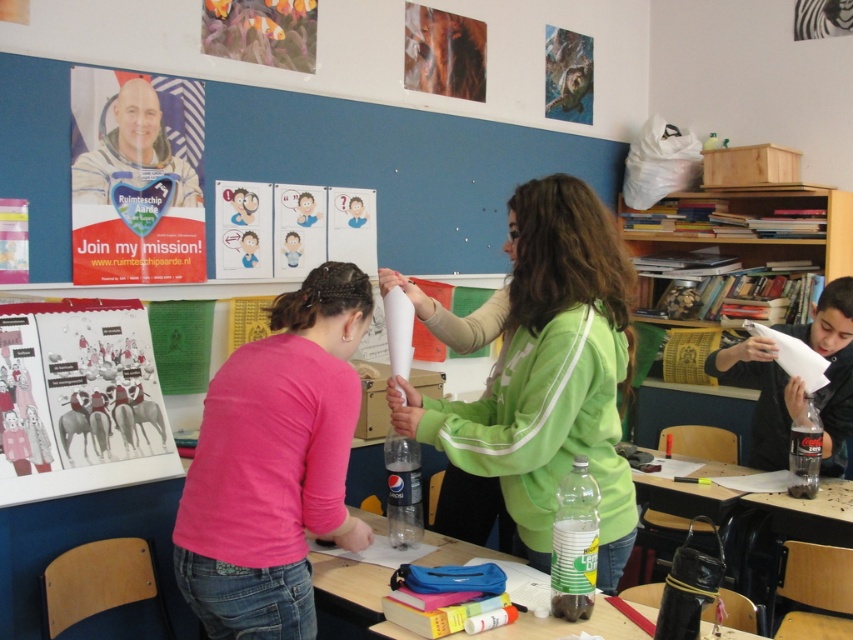
Question: Can you confirm if matte paper poster at upper left is thinner than translucent plastic bottle at center?

Choices:
 (A) no
 (B) yes

Answer: (B)

Question: Which object is farther from the camera taking this photo?

Choices:
 (A) space suit astronaut at upper left
 (B) translucent plastic bottle at center
 (C) pink fabric shirt at center
 (D) black plastic bottle at right

Answer: (D)

Question: Which point is farther to the camera?

Choices:
 (A) (605, 305)
 (B) (49, 323)
 (C) (312, 566)
 (D) (735, 369)

Answer: (D)

Question: Is matte green sweatshirt at center smaller than black plastic bottle at right?

Choices:
 (A) no
 (B) yes

Answer: (A)

Question: Where is matte green sweatshirt at center located in relation to matte paper poster at upper left in the image?

Choices:
 (A) left
 (B) right

Answer: (B)

Question: Which of these objects is positioned farthest from the matte green sweatshirt at center?

Choices:
 (A) matte paper poster at upper left
 (B) space suit astronaut at upper left

Answer: (B)